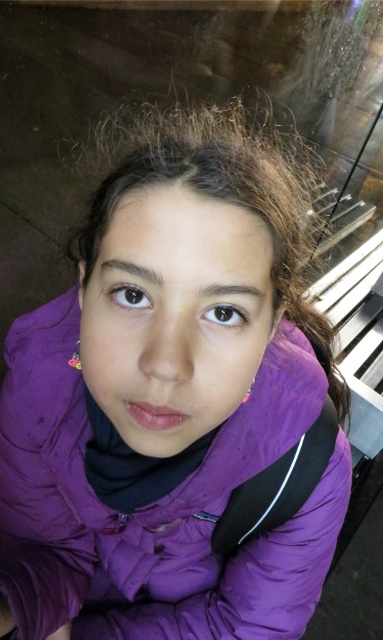
Is brown matte eye at upper center shorter than brown glossy eye at center?

No.

Who is higher up, brown matte eye at upper center or brown glossy eye at center?

brown matte eye at upper center is higher up.

Between point (140, 301) and point (243, 320), which one is positioned in front?

Point (140, 301)

Identify the location of brown matte eye at upper center. Image resolution: width=383 pixels, height=640 pixels. (129, 296).